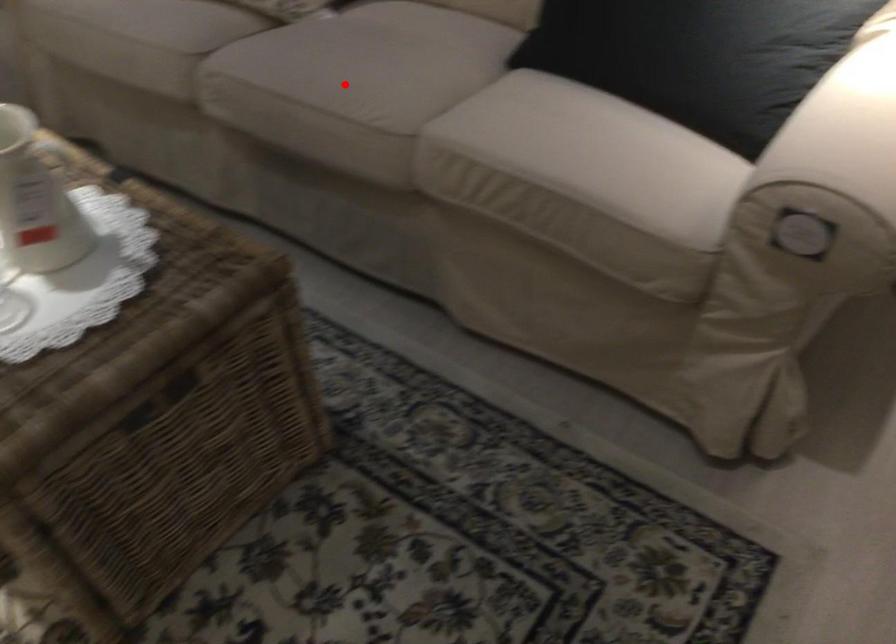
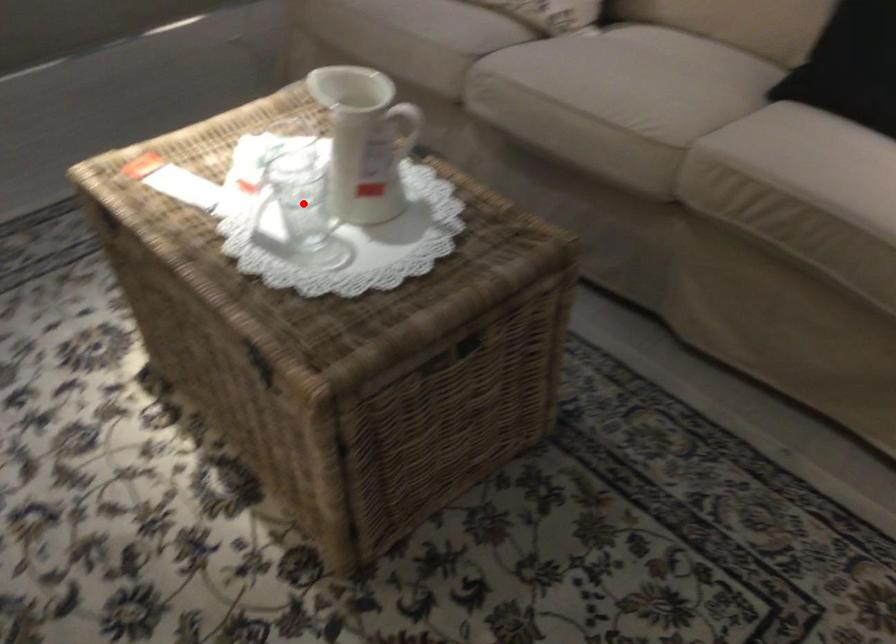
I am providing you with two images of the same scene from different viewpoints. A red point is marked on the first image and another point is marked on the second image. Is the red point in image1 aligned with the point shown in image2?

No